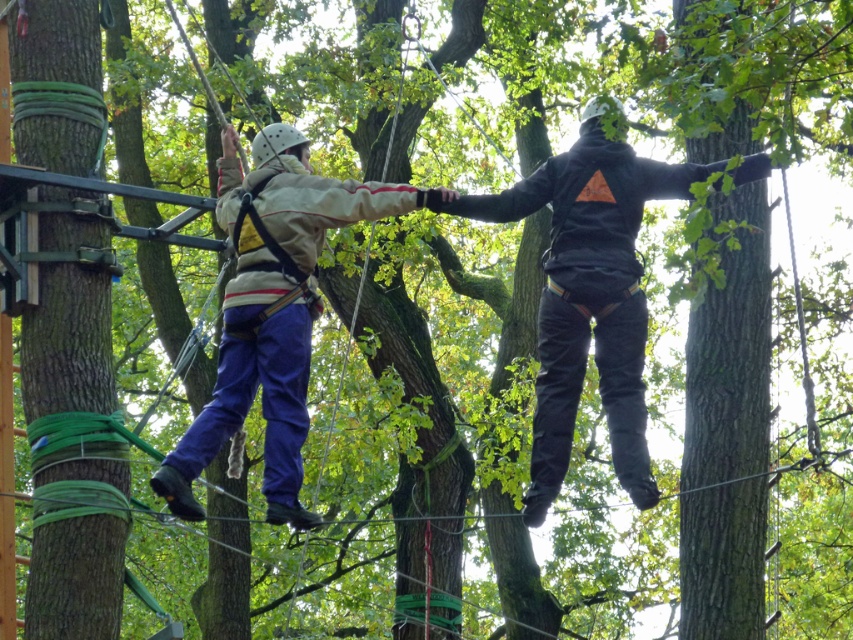
Does black matte hoodie at center appear on the right side of matte beige jacket at center?

Indeed, black matte hoodie at center is positioned on the right side of matte beige jacket at center.

Which is more to the left, black matte hoodie at center or matte beige jacket at center?

matte beige jacket at center is more to the left.

Is point (556, 314) positioned behind point (318, 200)?

Yes.

Find the location of `black matte hoodie at center`. black matte hoodie at center is located at coordinates (589, 296).